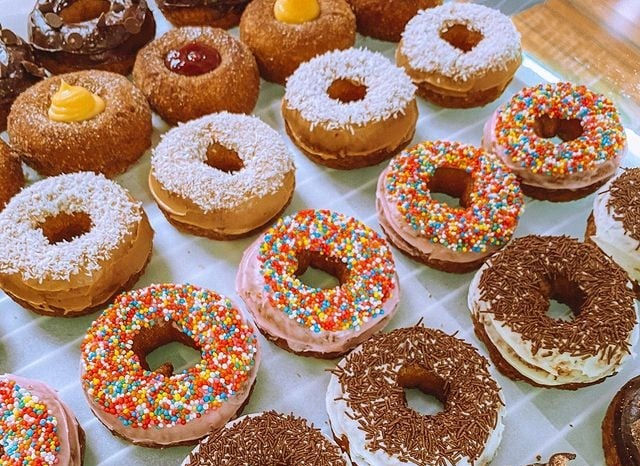
Locate an element on the screen. wood table top right corner is located at coordinates (610, 7), (548, 32), (624, 60).